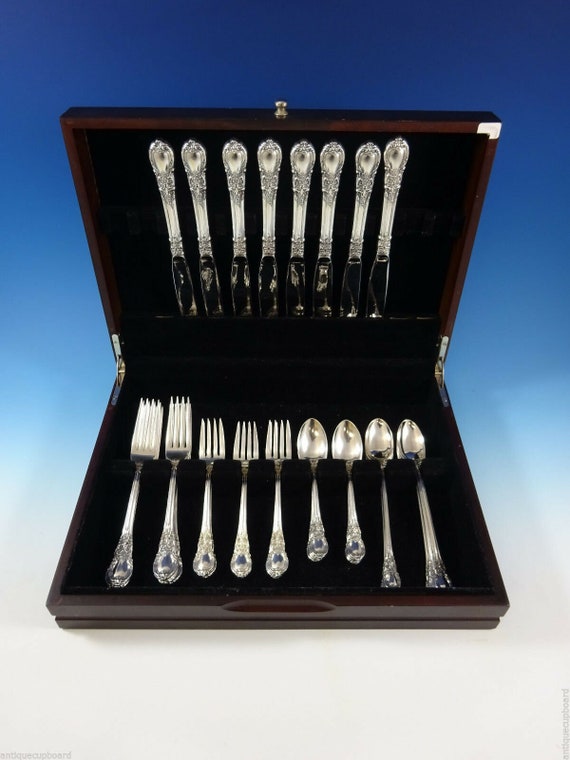
You are a GUI agent. You are given a task and a screenshot of the screen. Output one action in this format:
    pyautogui.click(x=<x>, y=<y>)
    Task: Click on the forks
    
    Given the screenshot: What is the action you would take?
    pyautogui.click(x=276, y=537), pyautogui.click(x=235, y=553), pyautogui.click(x=202, y=565), pyautogui.click(x=171, y=562), pyautogui.click(x=121, y=570), pyautogui.click(x=174, y=508), pyautogui.click(x=135, y=513)